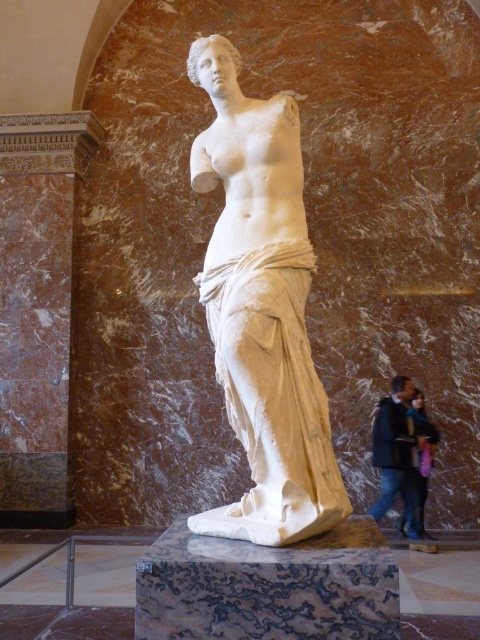
Question: From the image, what is the correct spatial relationship of white marble statue at center in relation to marble column at left?

Choices:
 (A) below
 (B) above

Answer: (A)

Question: Can you confirm if white marble statue at center is positioned below dark blue jacket at lower right?

Choices:
 (A) yes
 (B) no

Answer: (B)

Question: Estimate the real-world distances between objects in this image. Which object is farther from the marble/granite pedestal at center?

Choices:
 (A) white marble statue at center
 (B) dark blue jacket at lower right
 (C) marble column at left

Answer: (C)

Question: Which object is positioned closest to the white marble statue at center?

Choices:
 (A) marble/granite pedestal at center
 (B) dark blue jacket at lower right

Answer: (A)

Question: Does marble column at left come in front of marble/granite pedestal at center?

Choices:
 (A) yes
 (B) no

Answer: (B)

Question: Estimate the real-world distances between objects in this image. Which object is closer to the white marble statue at center?

Choices:
 (A) marble column at left
 (B) marble/granite pedestal at center

Answer: (B)